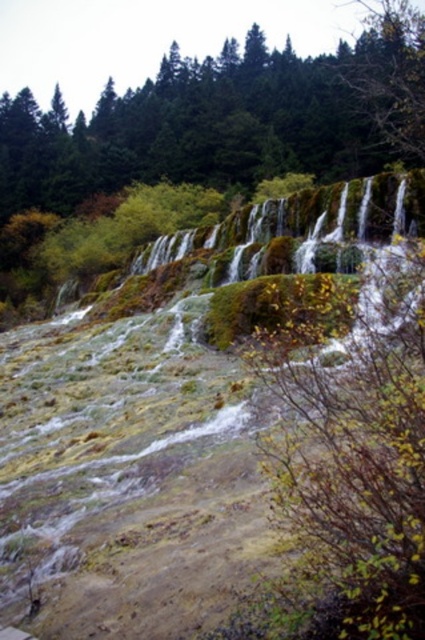
You are hiking along the trail and want to take a photo of the green mossy hillside at center and the green mossy rock at center. Which one should you point your camera towards if you want to capture the lower part of the scene?

You should point your camera towards the green mossy hillside at center because it is located below the green mossy rock at center, making it part of the lower section of the scene.

You are a hiker trying to cross the green mossy hillside at center and the green mossy rock at center. Which path would be more stable to walk on?

The green mossy rock at center is more stable to walk on because it is thicker than the green mossy hillside at center.

You are a hiker trying to navigate through the rugged terrain. You see the green mossy hillside at center. Based on its location, which direction should you head to reach the dense forest of coniferous trees in the background?

The green mossy hillside at center is located at point (217, 444), which is towards the lower part of the image. The dense forest of coniferous trees is in the background, so heading towards the upper part of the image from the green mossy hillside at center would lead you towards the forest.